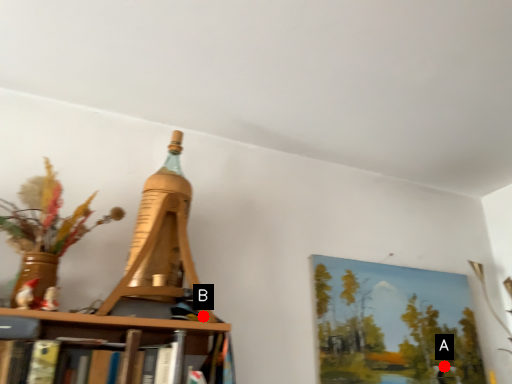
Question: Two points are circled on the image, labeled by A and B beside each circle. Which point is closer to the camera?

Choices:
 (A) A is closer
 (B) B is closer

Answer: (B)